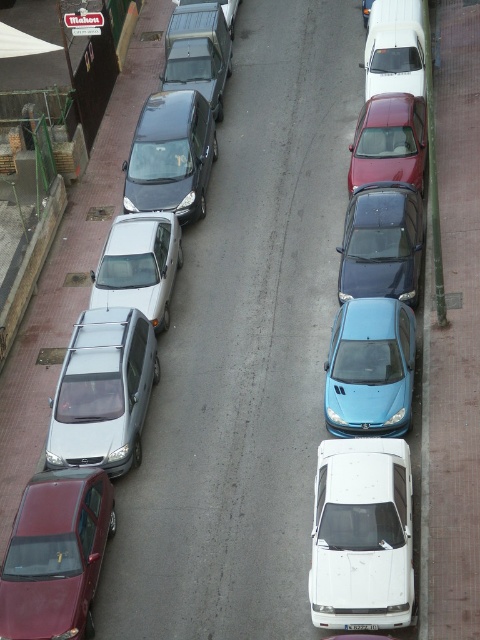
Which is above, white matte car at center or satin silver van at center-left?

satin silver van at center-left

Can you confirm if white matte car at center is wider than satin silver van at center-left?

No.

What do you see at coordinates (361, 534) in the screenshot? The height and width of the screenshot is (640, 480). I see `white matte car at center` at bounding box center [361, 534].

You are a GUI agent. You are given a task and a screenshot of the screen. Output one action in this format:
    pyautogui.click(x=<x>, y=<y>)
    Task: Click on the white matte car at center
    
    Given the screenshot: What is the action you would take?
    pyautogui.click(x=361, y=534)

Between satin black van at upper left and shiny red car at center, which one is positioned higher?

Positioned higher is shiny red car at center.

Does satin black van at upper left have a greater height compared to shiny red car at center?

Yes.

At what (x,y) coordinates should I click in order to perform the action: click on satin black van at upper left. Please return your answer as a coordinate pair (x, y). Image resolution: width=480 pixels, height=640 pixels. Looking at the image, I should click on (170, 156).

Identify the location of satin black van at upper left. (170, 156).

Who is more forward, (408, 179) or (348, 627)?

Positioned in front is point (348, 627).

Where is `shiny red car at center`? The width and height of the screenshot is (480, 640). shiny red car at center is located at coordinates (388, 141).